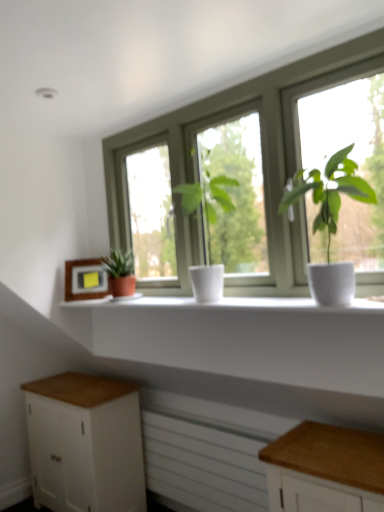
Question: Considering the relative sizes of white matte window sill at center and white matte plant pot at center, which is the 2th houseplant in back-to-front order, in the image provided, is white matte window sill at center shorter than white matte plant pot at center, which is the 2th houseplant in back-to-front order,?

Choices:
 (A) no
 (B) yes

Answer: (B)

Question: From a real-world perspective, is white matte window sill at center below white matte plant pot at center, the second houseplant from the right?

Choices:
 (A) yes
 (B) no

Answer: (A)

Question: Is white matte window sill at center further to camera compared to white matte plant pot at center, positioned as the second houseplant in left-to-right order?

Choices:
 (A) no
 (B) yes

Answer: (A)

Question: Would you say white matte plant pot at center, positioned as the second houseplant in left-to-right order, is part of white matte window sill at center's contents?

Choices:
 (A) no
 (B) yes

Answer: (A)

Question: Is white matte window sill at center positioned with its back to white matte plant pot at center, the second houseplant from the right?

Choices:
 (A) yes
 (B) no

Answer: (B)

Question: Does white matte window sill at center have a larger size compared to white matte plant pot at center, positioned as the second houseplant in left-to-right order?

Choices:
 (A) no
 (B) yes

Answer: (A)

Question: Considering the relative sizes of white matte window at center and green matte plant at left, arranged as the first houseplant when viewed from the back, in the image provided, is white matte window at center smaller than green matte plant at left, arranged as the first houseplant when viewed from the back,?

Choices:
 (A) yes
 (B) no

Answer: (B)

Question: From a real-world perspective, does white matte window at center stand above green matte plant at left, marked as the third houseplant in a right-to-left arrangement?

Choices:
 (A) yes
 (B) no

Answer: (A)

Question: Can you confirm if white matte window at center is taller than green matte plant at left, arranged as the first houseplant when viewed from the back?

Choices:
 (A) yes
 (B) no

Answer: (A)

Question: Is white matte window at center aimed at green matte plant at left, marked as the third houseplant in a right-to-left arrangement?

Choices:
 (A) yes
 (B) no

Answer: (A)

Question: Is white matte window at center further to camera compared to green matte plant at left, which is counted as the third houseplant, starting from the front?

Choices:
 (A) no
 (B) yes

Answer: (A)

Question: Are white matte window at center and green matte plant at left, arranged as the first houseplant when viewed from the back, making contact?

Choices:
 (A) yes
 (B) no

Answer: (B)

Question: Does wooden frame at left lie behind white matte window sill at center?

Choices:
 (A) no
 (B) yes

Answer: (B)